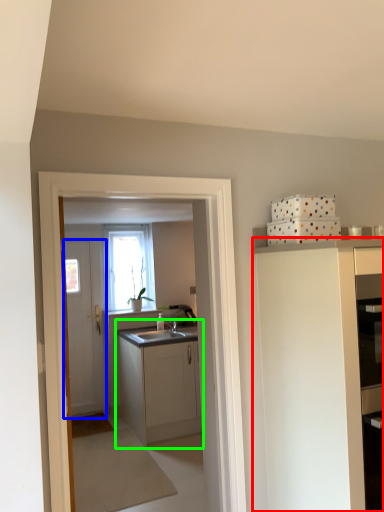
Question: Which object is the closest to the cabinetry (highlighted by a red box)? Choose among these: door (highlighted by a blue box) or cabinetry (highlighted by a green box).

Choices:
 (A) door
 (B) cabinetry

Answer: (B)